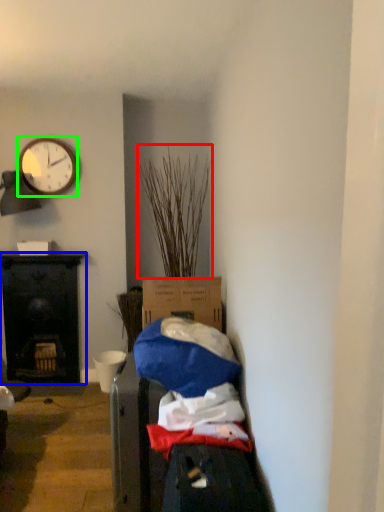
Question: Which object is the closest to the plant (highlighted by a red box)? Choose among these: desk (highlighted by a blue box) or clock (highlighted by a green box).

Choices:
 (A) desk
 (B) clock

Answer: (B)